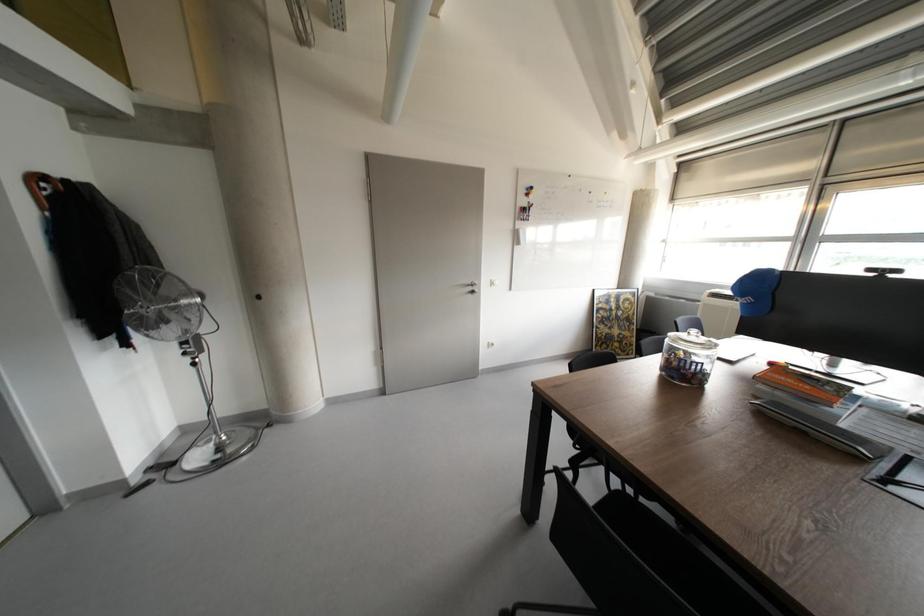
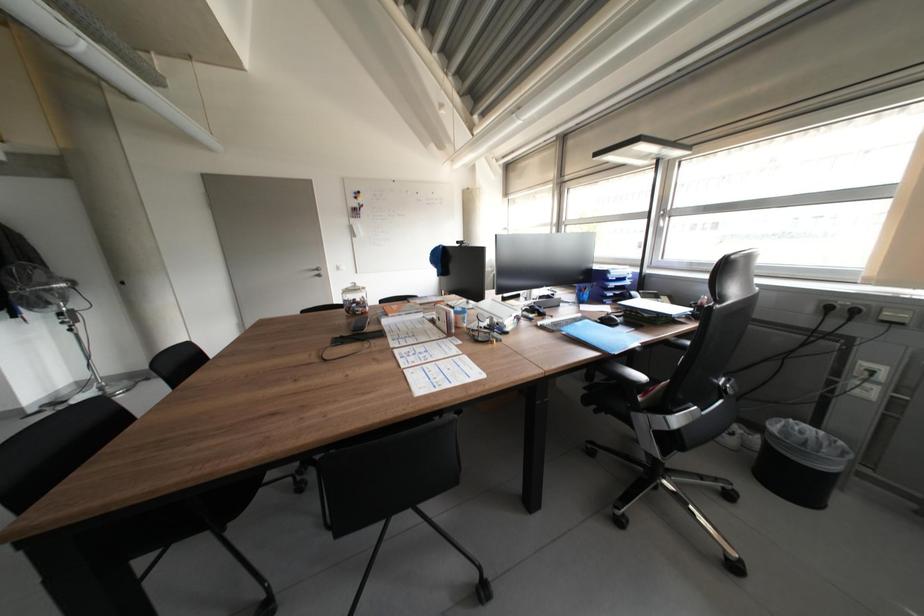
What movement of the cameraman would produce the second image?

The movement direction of the cameraman is right, backward.